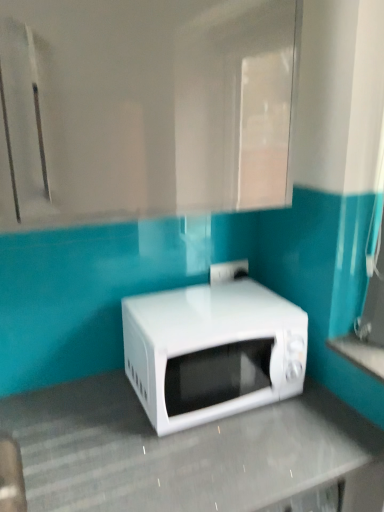
What are the coordinates of `vacant area that is in front of white glossy microwave at center` in the screenshot? It's located at (204, 459).